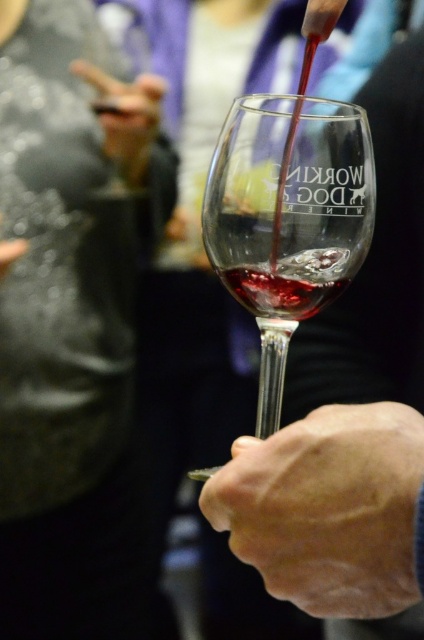
What do you see at coordinates (290, 282) in the screenshot? This screenshot has height=640, width=424. I see `translucent glass at center` at bounding box center [290, 282].

In order to click on translucent glass at center in this screenshot , I will do `click(290, 282)`.

Is transparent glass at center shorter than smooth leather glove at upper left?

In fact, transparent glass at center may be taller than smooth leather glove at upper left.

The image size is (424, 640). I want to click on transparent glass at center, so click(287, 218).

Who is higher up, transparent glass at center or translucent glass at center?

translucent glass at center is above.

Which of these two, transparent glass at center or translucent glass at center, stands taller?

transparent glass at center is taller.

The height and width of the screenshot is (640, 424). In order to click on transparent glass at center in this screenshot , I will do `click(287, 218)`.

The image size is (424, 640). Find the location of `transparent glass at center`. transparent glass at center is located at coordinates (287, 218).